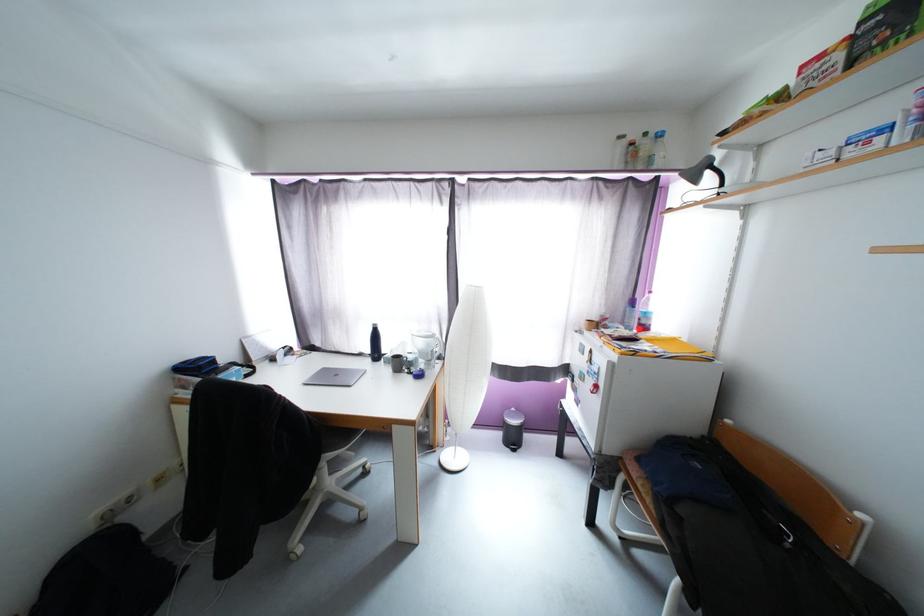
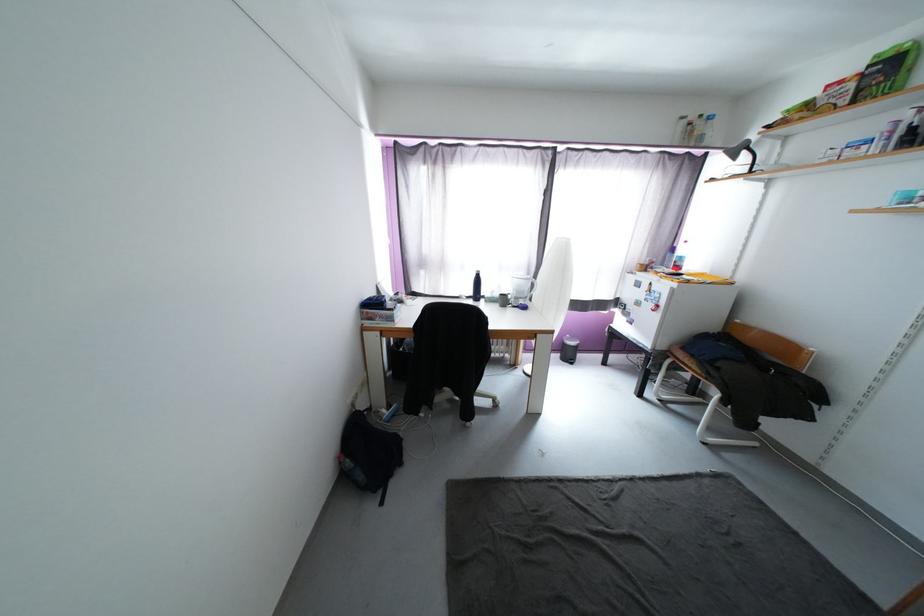
Locate, in the second image, the point that corresponds to point (505, 437) in the first image.

(564, 357)